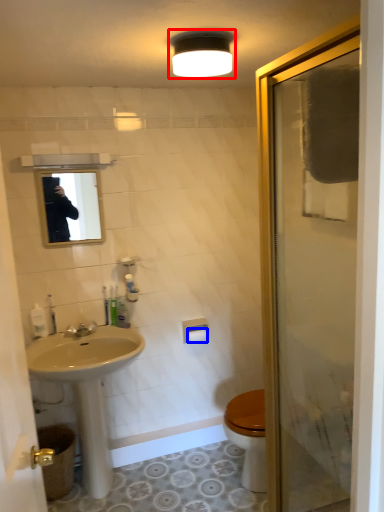
Question: Among these objects, which one is nearest to the camera, light fixture (highlighted by a red box) or toilet paper (highlighted by a blue box)?

Choices:
 (A) light fixture
 (B) toilet paper

Answer: (A)